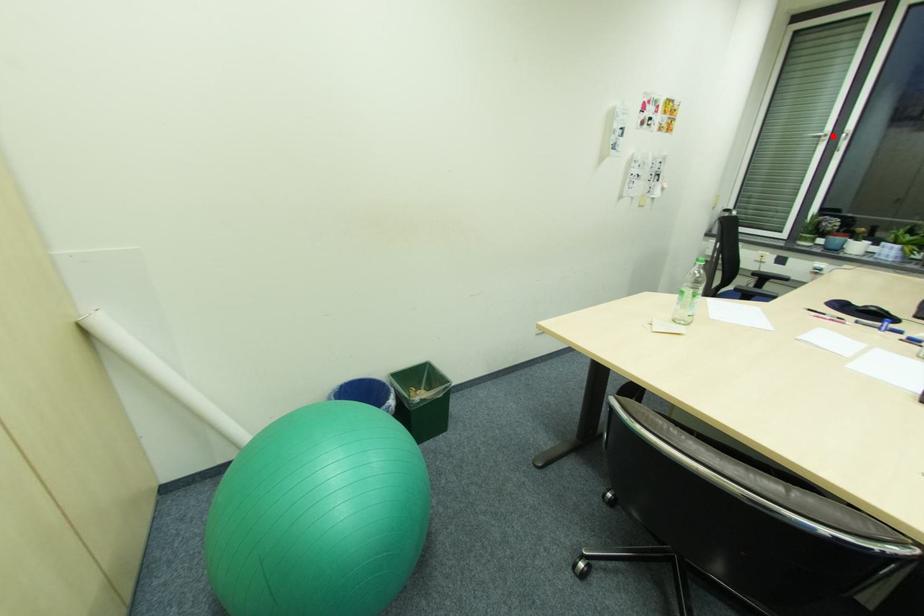
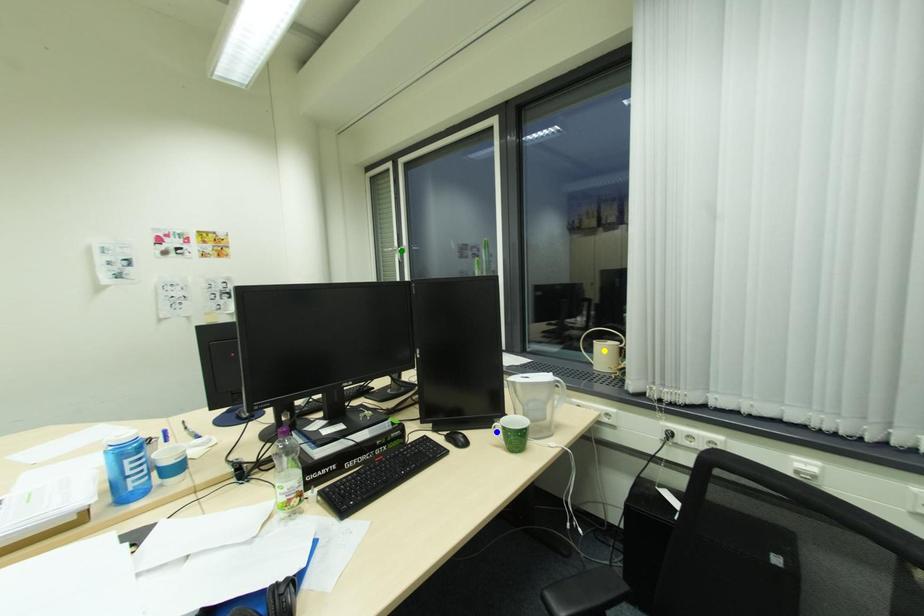
Question: I am providing you with two images of the same scene from different viewpoints. A red point is marked on the first image. You are given multiple points on the second image. Which point in image 2 represents the same 3d spot as the red point in image 1?

Choices:
 (A) yellow point
 (B) blue point
 (C) green point

Answer: (C)